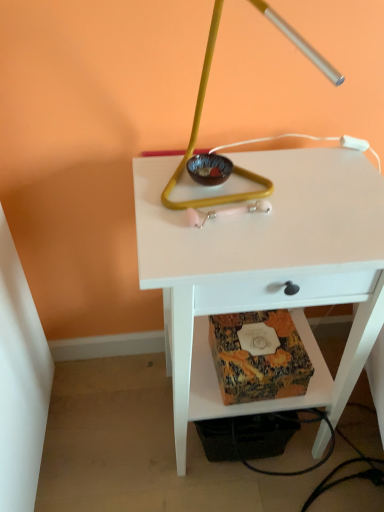
Question: Is white matte table at center wider or thinner than matte brown glass bowl at center?

Choices:
 (A) thin
 (B) wide

Answer: (B)

Question: In terms of height, does white matte table at center look taller or shorter compared to matte brown glass bowl at center?

Choices:
 (A) short
 (B) tall

Answer: (B)

Question: Estimate the real-world distances between objects in this image. Which object is closer to the matte brown glass bowl at center?

Choices:
 (A) white matte table at center
 (B) patterned paper at lower center
 (C) metallic gold lamp at center

Answer: (C)

Question: Considering the real-world distances, which object is farthest from the metallic gold lamp at center?

Choices:
 (A) white matte table at center
 (B) patterned paper at lower center
 (C) matte brown glass bowl at center

Answer: (B)